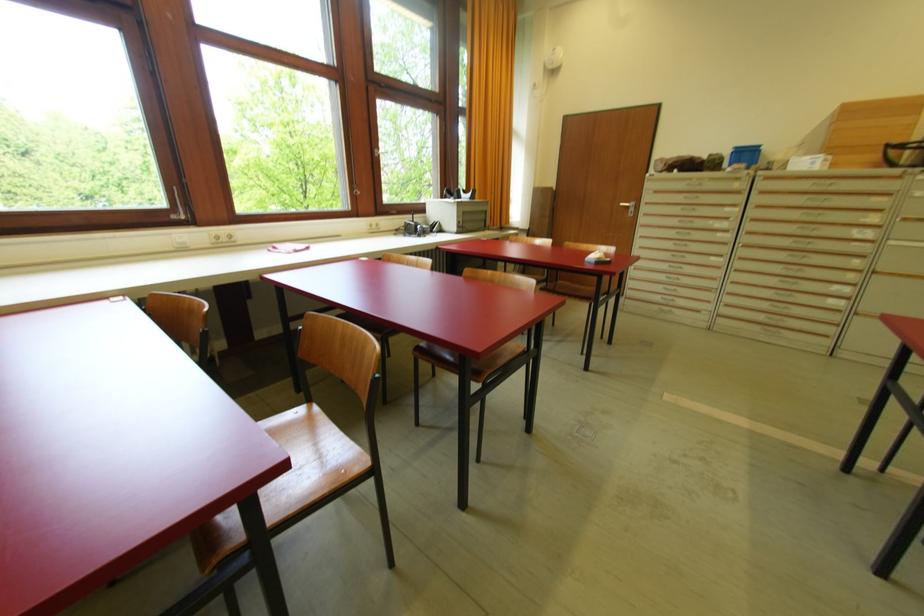
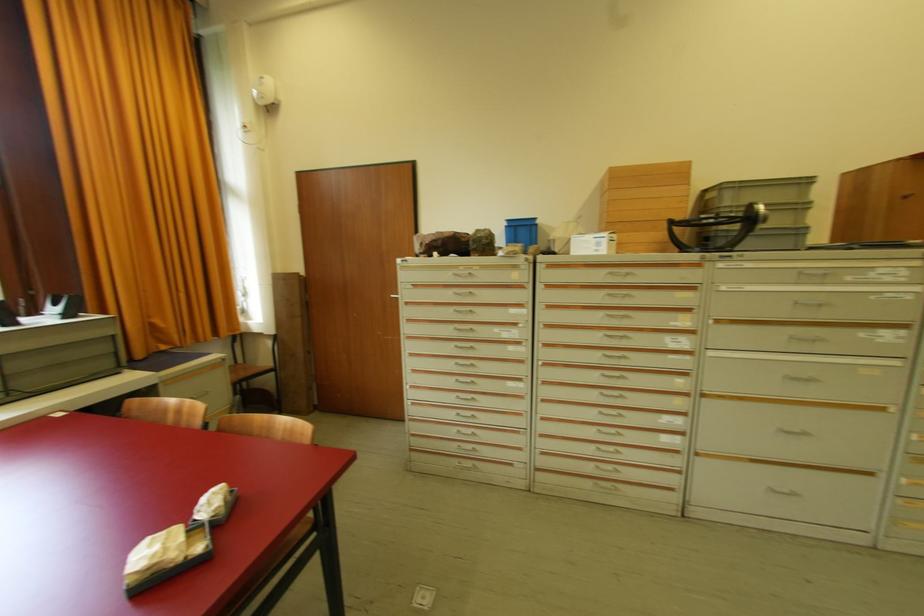
Where in the second image is the point corresponding to (x=835, y=167) from the first image?

(623, 248)